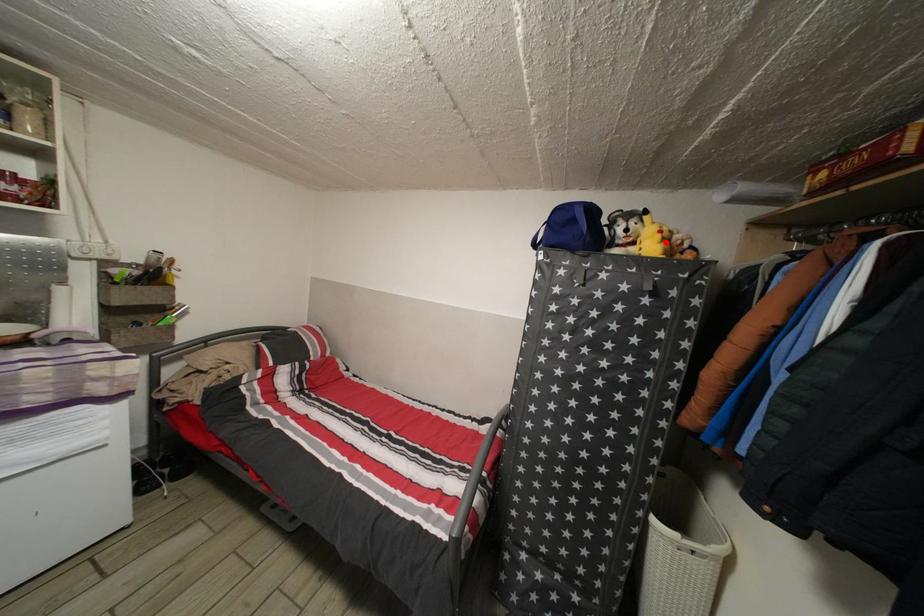
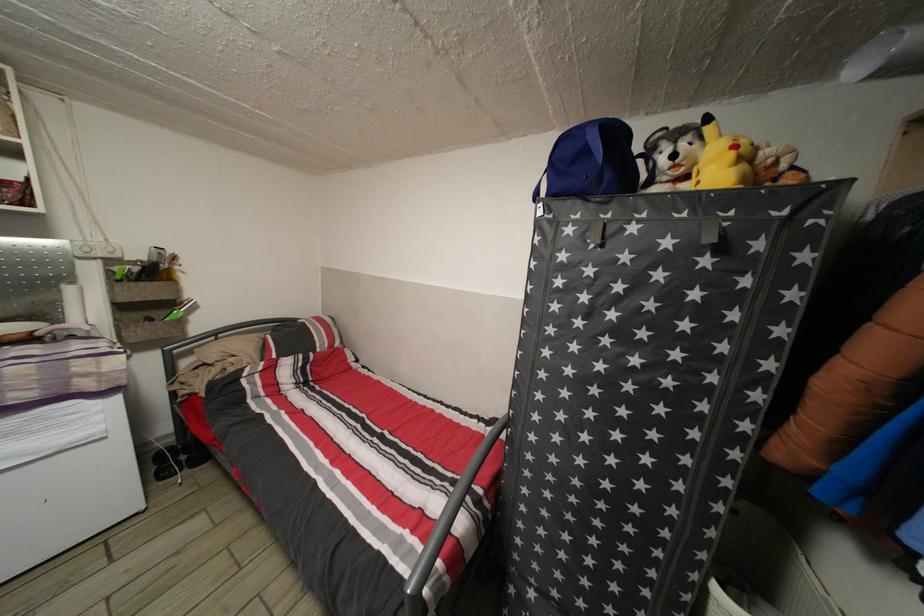
Where in the second image is the point corresponding to the highlighted location from the first image?

(738, 161)